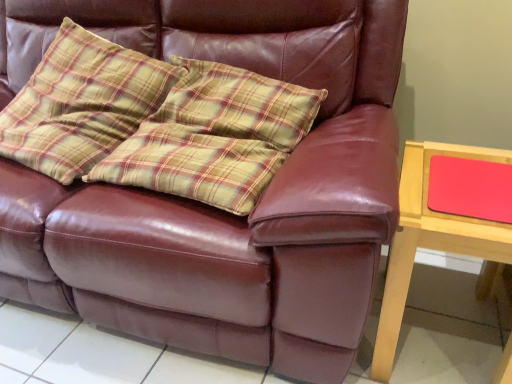
Question: Considering the relative sizes of plaid fabric pillow at upper left and wooden table at right in the image provided, is plaid fabric pillow at upper left taller than wooden table at right?

Choices:
 (A) no
 (B) yes

Answer: (B)

Question: Could you tell me if plaid fabric pillow at upper left is turned towards wooden table at right?

Choices:
 (A) yes
 (B) no

Answer: (B)

Question: From a real-world perspective, is plaid fabric pillow at upper left physically above wooden table at right?

Choices:
 (A) no
 (B) yes

Answer: (B)

Question: Would you consider plaid fabric pillow at upper left to be distant from wooden table at right?

Choices:
 (A) no
 (B) yes

Answer: (A)

Question: Is plaid fabric pillow at upper left turned away from wooden table at right?

Choices:
 (A) no
 (B) yes

Answer: (A)

Question: From the image's perspective, is plaid fabric pillow at upper left on wooden table at right?

Choices:
 (A) yes
 (B) no

Answer: (A)

Question: Is matte red mousepad at right far away from plaid fabric pillow at upper left?

Choices:
 (A) no
 (B) yes

Answer: (B)

Question: Is matte red mousepad at right further to camera compared to plaid fabric pillow at upper left?

Choices:
 (A) yes
 (B) no

Answer: (B)

Question: Considering the relative sizes of matte red mousepad at right and plaid fabric pillow at upper left in the image provided, is matte red mousepad at right wider than plaid fabric pillow at upper left?

Choices:
 (A) yes
 (B) no

Answer: (B)

Question: Does matte red mousepad at right appear on the right side of plaid fabric pillow at upper left?

Choices:
 (A) no
 (B) yes

Answer: (B)

Question: Is plaid fabric pillow at upper left surrounded by matte red mousepad at right?

Choices:
 (A) no
 (B) yes

Answer: (A)

Question: Is matte red mousepad at right directly adjacent to plaid fabric pillow at upper left?

Choices:
 (A) no
 (B) yes

Answer: (A)

Question: From the image's perspective, is plaid fabric pillow at upper left below matte red mousepad at right?

Choices:
 (A) yes
 (B) no

Answer: (B)